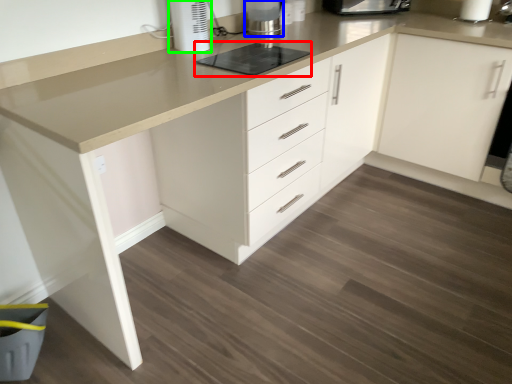
Question: Estimate the real-world distances between objects in this image. Which object is closer to appliance (highlighted by a red box), home appliance (highlighted by a blue box) or home appliance (highlighted by a green box)?

Choices:
 (A) home appliance
 (B) home appliance

Answer: (B)